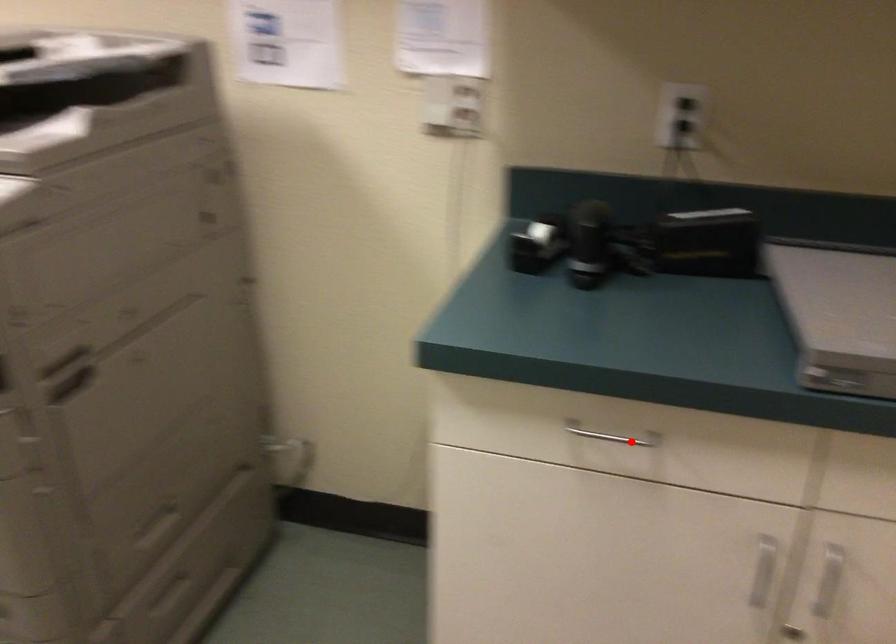
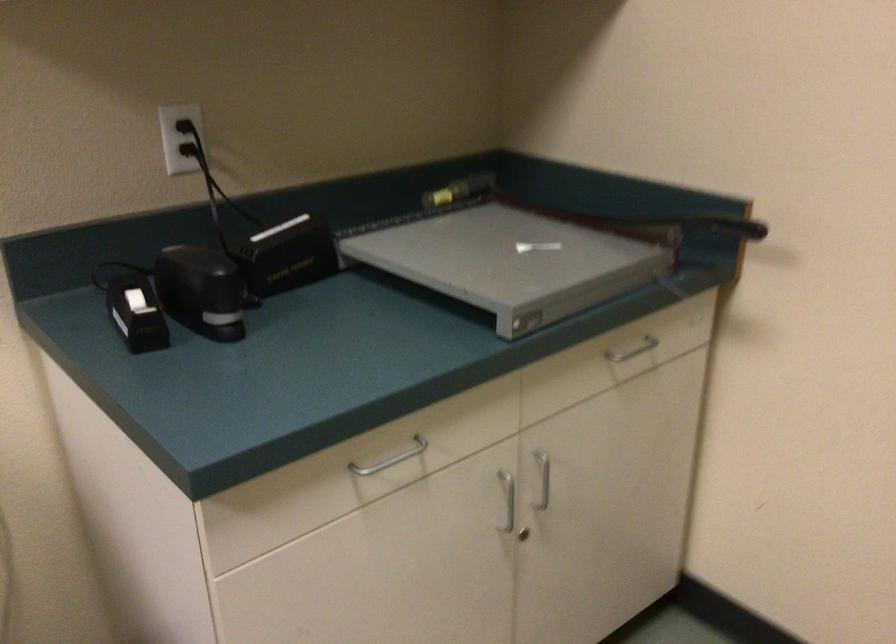
The point at the highlighted location is marked in the first image. Where is the corresponding point in the second image?

(391, 459)